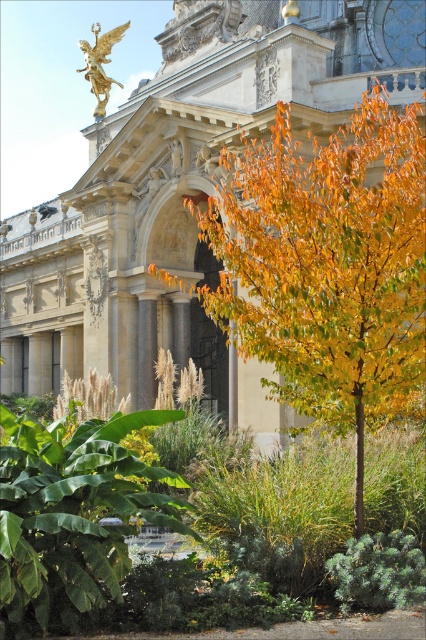
Question: Among these points, which one is nearest to the camera?

Choices:
 (A) (409, 332)
 (B) (115, 140)
 (C) (109, 48)

Answer: (A)

Question: Which point is farther to the camera?

Choices:
 (A) gold polished statue at upper center
 (B) golden yellow leaves at center

Answer: (A)

Question: Based on their relative distances, which object is nearer to the gold polished statue at upper center?

Choices:
 (A) beige stone palace at center
 (B) golden yellow leaves at center

Answer: (A)

Question: Is golden yellow leaves at center bigger than gold polished statue at upper center?

Choices:
 (A) yes
 (B) no

Answer: (A)

Question: Is the position of golden yellow leaves at center more distant than that of gold polished statue at upper center?

Choices:
 (A) yes
 (B) no

Answer: (B)

Question: Is beige stone palace at center in front of gold polished statue at upper center?

Choices:
 (A) no
 (B) yes

Answer: (B)